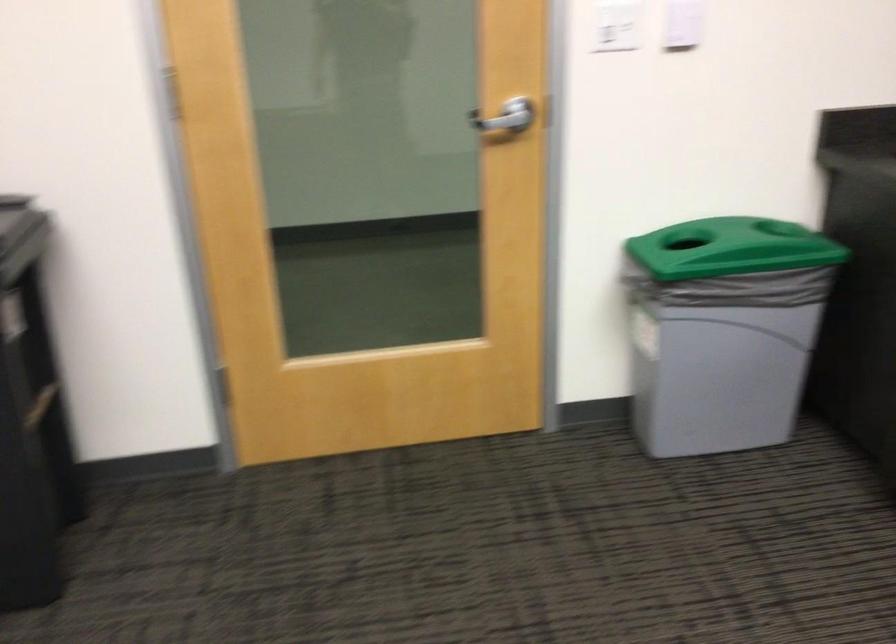
At what (x,y) coordinates should I click in order to perform the action: click on green trash can lid. Please return your answer as a coordinate pair (x, y). Image resolution: width=896 pixels, height=644 pixels. Looking at the image, I should click on (759, 238).